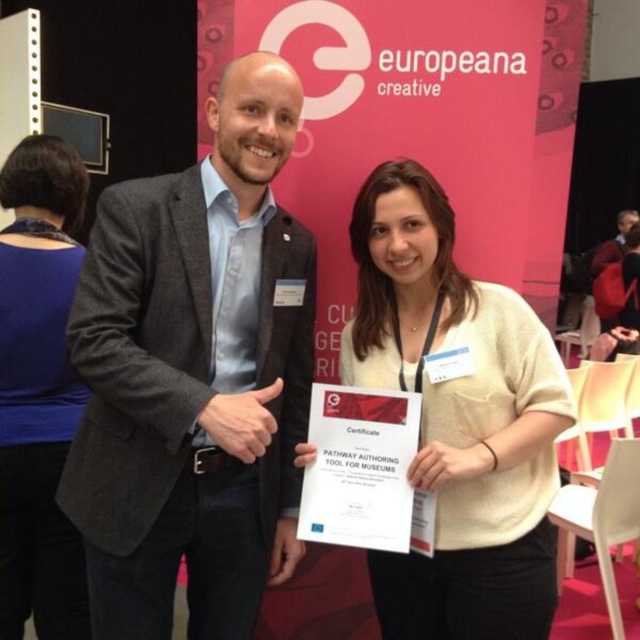
The width and height of the screenshot is (640, 640). In order to click on gray woolen blazer at center in this screenshot , I will do `click(195, 376)`.

Who is more forward, (216, 128) or (60, 326)?

Point (216, 128) is in front.

At what (x,y) coordinates should I click in order to perform the action: click on gray woolen blazer at center. Please return your answer as a coordinate pair (x, y). Looking at the image, I should click on (195, 376).

Does gray woolen blazer at center have a smaller size compared to white cotton shirt at center?

Actually, gray woolen blazer at center might be larger than white cotton shirt at center.

Which is above, gray woolen blazer at center or white cotton shirt at center?

Positioned higher is gray woolen blazer at center.

Is point (76, 520) farther from viewer compared to point (540, 580)?

Yes.

This screenshot has width=640, height=640. Identify the location of gray woolen blazer at center. (195, 376).

Is white cotton shirt at center closer to the viewer compared to blue fabric shirt at upper left?

Yes, white cotton shirt at center is in front of blue fabric shirt at upper left.

Between point (454, 387) and point (67, 308), which one is positioned in front?

Point (454, 387) is in front.

Identify the location of white cotton shirt at center. (458, 419).